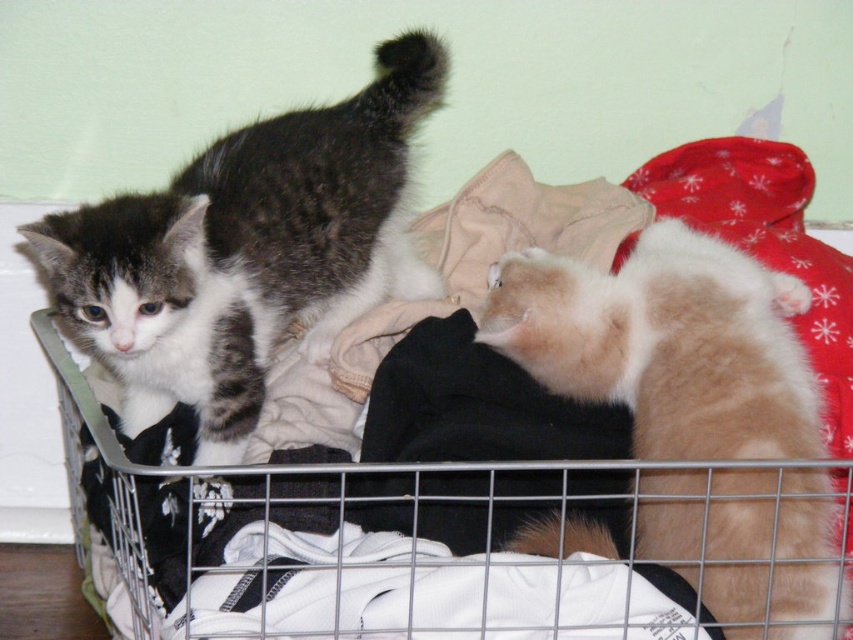
Question: Is metallic silver shopping basket at center thinner than gray-white fur cat at left?

Choices:
 (A) no
 (B) yes

Answer: (A)

Question: Which object is farther from the camera taking this photo?

Choices:
 (A) fuzzy beige cat at lower right
 (B) metallic silver shopping basket at center

Answer: (A)

Question: Which object appears farthest from the camera in this image?

Choices:
 (A) fuzzy beige cat at lower right
 (B) gray-white fur cat at left

Answer: (B)

Question: Which object is farther from the camera taking this photo?

Choices:
 (A) fuzzy beige cat at lower right
 (B) gray-white fur cat at left
 (C) metallic silver shopping basket at center

Answer: (B)

Question: Can you confirm if gray-white fur cat at left is bigger than fuzzy beige cat at lower right?

Choices:
 (A) yes
 (B) no

Answer: (A)

Question: Is metallic silver shopping basket at center thinner than fuzzy beige cat at lower right?

Choices:
 (A) yes
 (B) no

Answer: (B)